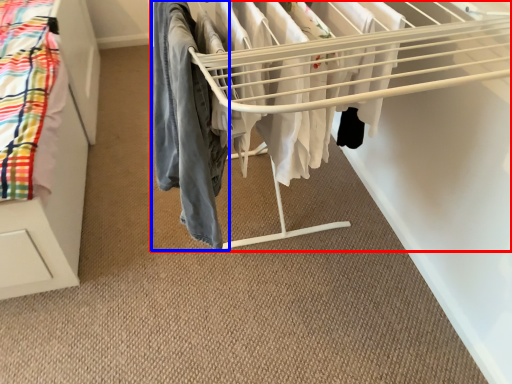
Question: Which of the following is the farthest to the observer, bunk bed (highlighted by a red box) or clothing (highlighted by a blue box)?

Choices:
 (A) bunk bed
 (B) clothing

Answer: (B)